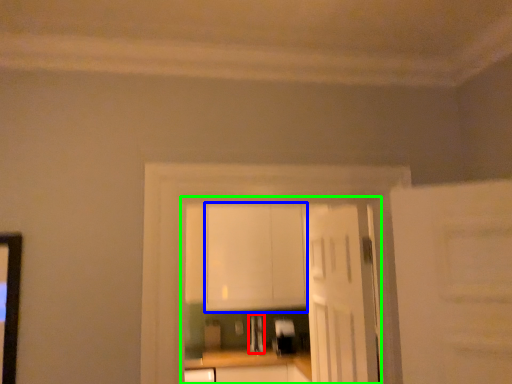
Question: Which object is the farthest from appliance (highlighted by a red box)? Choose among these: cabinetry (highlighted by a blue box) or entertainment center (highlighted by a green box).

Choices:
 (A) cabinetry
 (B) entertainment center

Answer: (A)